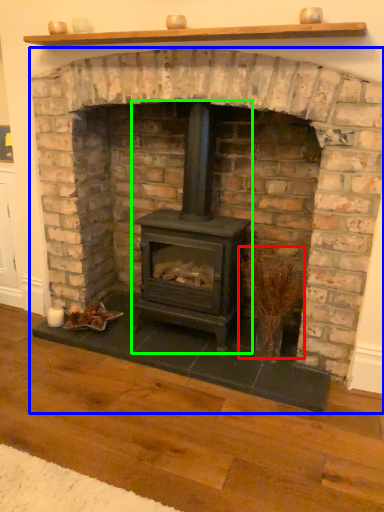
Question: Considering the real-world distances, which object is farthest from twig (highlighted by a red box)? fireplace (highlighted by a blue box) or wood burning stove (highlighted by a green box)?

Choices:
 (A) fireplace
 (B) wood burning stove

Answer: (A)